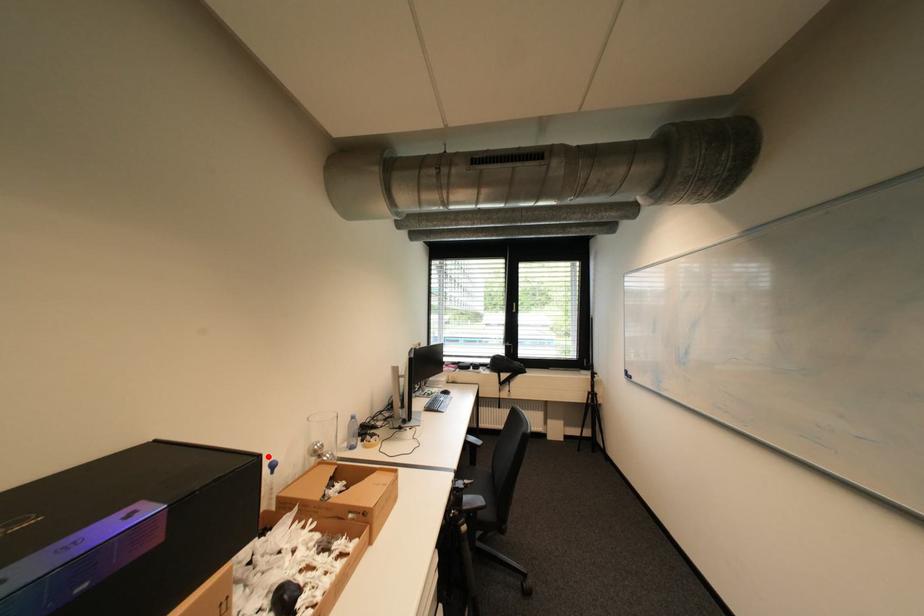
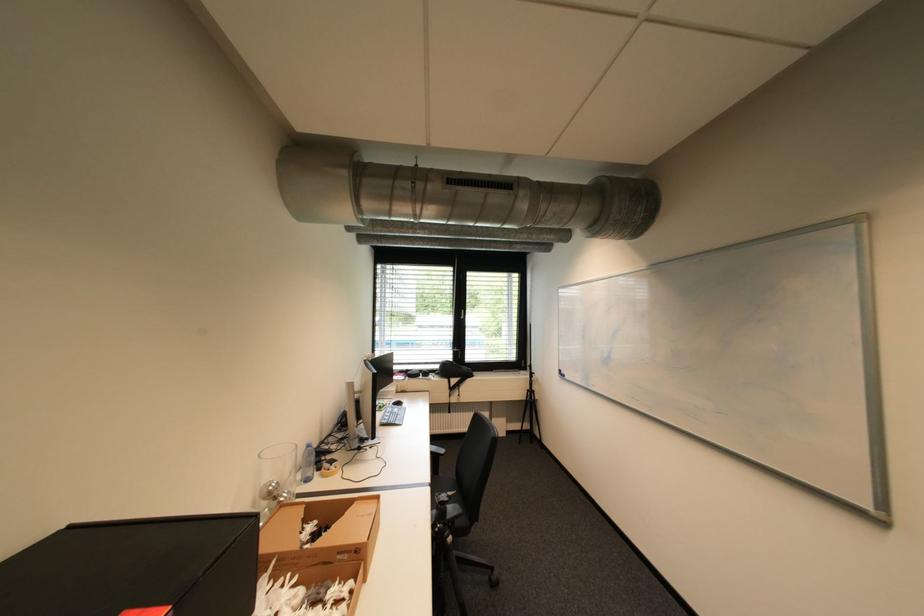
Question: I am providing you with two images of the same scene from different viewpoints. Given a red point in image1, look at the same physical point in image2. Is it:

Choices:
 (A) Closer to the viewpoint
 (B) Farther from the viewpoint

Answer: (A)